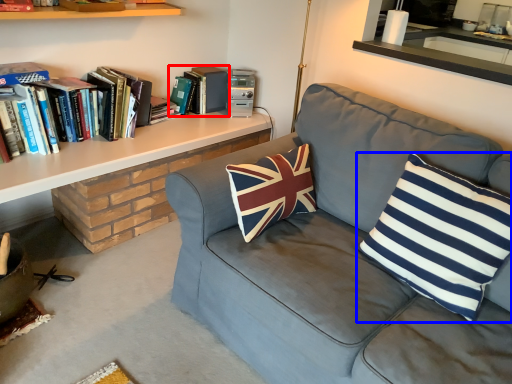
Question: Among these objects, which one is nearest to the camera, book (highlighted by a red box) or pillow (highlighted by a blue box)?

Choices:
 (A) book
 (B) pillow

Answer: (B)